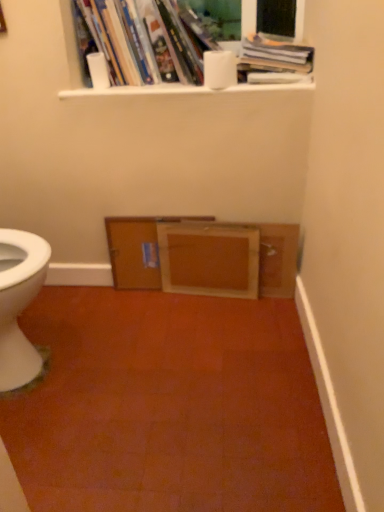
The height and width of the screenshot is (512, 384). What do you see at coordinates (135, 249) in the screenshot? I see `wooden frame at center` at bounding box center [135, 249].

The image size is (384, 512). Describe the element at coordinates (138, 250) in the screenshot. I see `wooden cabinet at center, placed as the first file cabinet when sorted from left to right` at that location.

This screenshot has width=384, height=512. What do you see at coordinates (275, 58) in the screenshot?
I see `hardcover book at upper center, positioned as the first book in right-to-left order` at bounding box center [275, 58].

Where is `wooden frame at center, acting as the 2th file cabinet starting from the left`? This screenshot has height=512, width=384. wooden frame at center, acting as the 2th file cabinet starting from the left is located at coordinates (209, 259).

This screenshot has height=512, width=384. Describe the element at coordinates (209, 259) in the screenshot. I see `wooden frame at center, which is counted as the first file cabinet, starting from the right` at that location.

This screenshot has width=384, height=512. What are the coordinates of `white glossy window sill at upper center` in the screenshot? It's located at (183, 90).

Is white matte toilet paper at upper center, arranged as the second toilet paper when viewed from the left, far from wooden frame at center, which is counted as the first file cabinet, starting from the right?

No, there isn't a large distance between white matte toilet paper at upper center, arranged as the second toilet paper when viewed from the left, and wooden frame at center, which is counted as the first file cabinet, starting from the right.

Is white matte toilet paper at upper center, arranged as the second toilet paper when viewed from the left, oriented towards wooden frame at center, which is counted as the first file cabinet, starting from the right?

No.

Which object is closer to the camera taking this photo, white matte toilet paper at upper center, which is counted as the first toilet paper, starting from the right, or wooden frame at center, which is counted as the first file cabinet, starting from the right?

white matte toilet paper at upper center, which is counted as the first toilet paper, starting from the right.

Is white matte toilet paper at upper center, which is counted as the first toilet paper, starting from the right, spatially inside wooden frame at center, acting as the 2th file cabinet starting from the left, or outside of it?

white matte toilet paper at upper center, which is counted as the first toilet paper, starting from the right, exists outside the volume of wooden frame at center, acting as the 2th file cabinet starting from the left.

Is wooden frame at center, which is counted as the first file cabinet, starting from the right, shorter than white matte toilet paper at upper center, arranged as the second toilet paper when viewed from the left?

No.

In the image, is wooden frame at center, which is counted as the first file cabinet, starting from the right, positioned in front of or behind white matte toilet paper at upper center, which is counted as the first toilet paper, starting from the right?

wooden frame at center, which is counted as the first file cabinet, starting from the right, is positioned farther from the viewer than white matte toilet paper at upper center, which is counted as the first toilet paper, starting from the right.

From the image's perspective, between wooden frame at center, acting as the 2th file cabinet starting from the left, and white matte toilet paper at upper center, which is counted as the first toilet paper, starting from the right, who is located below?

From the image's view, wooden frame at center, acting as the 2th file cabinet starting from the left, is below.

Looking at the image, does wooden frame at center, acting as the 2th file cabinet starting from the left, seem bigger or smaller compared to white matte toilet paper at upper center, arranged as the second toilet paper when viewed from the left?

Clearly, wooden frame at center, acting as the 2th file cabinet starting from the left, is larger in size than white matte toilet paper at upper center, arranged as the second toilet paper when viewed from the left.

Which object is wider, hardcover book at upper center, which appears as the 2th book when viewed from the left, or hardcover books at upper center, the 2th book when ordered from right to left?

hardcover book at upper center, which appears as the 2th book when viewed from the left, is wider.

From the image's perspective, which one is positioned higher, hardcover book at upper center, positioned as the first book in right-to-left order, or hardcover books at upper center, which is counted as the first book, starting from the left?

hardcover books at upper center, which is counted as the first book, starting from the left.

Can you confirm if hardcover book at upper center, which appears as the 2th book when viewed from the left, is positioned to the left of hardcover books at upper center, the 2th book when ordered from right to left?

Incorrect, hardcover book at upper center, which appears as the 2th book when viewed from the left, is not on the left side of hardcover books at upper center, the 2th book when ordered from right to left.

From a real-world perspective, which is physically above, hardcover book at upper center, positioned as the first book in right-to-left order, or hardcover books at upper center, which is counted as the first book, starting from the left?

hardcover books at upper center, which is counted as the first book, starting from the left.

Considering the positions of objects wooden frame at center and hardcover book at upper center, positioned as the first book in right-to-left order, in the image provided, who is more to the left, wooden frame at center or hardcover book at upper center, positioned as the first book in right-to-left order,?

wooden frame at center is more to the left.

From the image's perspective, is wooden frame at center beneath hardcover book at upper center, which appears as the 2th book when viewed from the left?

Answer: Correct, wooden frame at center appears lower than hardcover book at upper center, which appears as the 2th book when viewed from the left, in the image.

From a real-world perspective, relative to hardcover book at upper center, positioned as the first book in right-to-left order, is wooden frame at center vertically above or below?

wooden frame at center is situated lower than hardcover book at upper center, positioned as the first book in right-to-left order, in the real world.

Based on the photo, does wooden frame at center have a smaller size compared to hardcover book at upper center, positioned as the first book in right-to-left order?

Indeed, wooden frame at center has a smaller size compared to hardcover book at upper center, positioned as the first book in right-to-left order.

Is hardcover books at upper center, which is counted as the first book, starting from the left, in front of or behind wooden cabinet at center, the second file cabinet when ordered from right to left, in the image?

In the image, hardcover books at upper center, which is counted as the first book, starting from the left, appears in front of wooden cabinet at center, the second file cabinet when ordered from right to left.

From the image's perspective, between hardcover books at upper center, which is counted as the first book, starting from the left, and wooden cabinet at center, the second file cabinet when ordered from right to left, who is located below?

wooden cabinet at center, the second file cabinet when ordered from right to left.

Is there a large distance between hardcover books at upper center, which is counted as the first book, starting from the left, and wooden cabinet at center, placed as the first file cabinet when sorted from left to right?

No, hardcover books at upper center, which is counted as the first book, starting from the left, is not far from wooden cabinet at center, placed as the first file cabinet when sorted from left to right.

Does hardcover books at upper center, which is counted as the first book, starting from the left, have a lesser width compared to wooden cabinet at center, the second file cabinet when ordered from right to left?

Incorrect, the width of hardcover books at upper center, which is counted as the first book, starting from the left, is not less than that of wooden cabinet at center, the second file cabinet when ordered from right to left.

How far apart are hardcover books at upper center, which is counted as the first book, starting from the left, and wooden frame at center?

24.77 inches.

Is wooden frame at center completely or partially inside hardcover books at upper center, the 2th book when ordered from right to left?

No, wooden frame at center is not inside hardcover books at upper center, the 2th book when ordered from right to left.

From the image's perspective, between hardcover books at upper center, the 2th book when ordered from right to left, and wooden frame at center, which one is located above?

hardcover books at upper center, the 2th book when ordered from right to left, from the image's perspective.

Find the location of a particular element. The width and height of the screenshot is (384, 512). entertainment center behind the hardcover books at upper center, the 2th book when ordered from right to left is located at coordinates (135, 249).

From the image's perspective, is hardcover book at upper center, positioned as the first book in right-to-left order, located above or below wooden cabinet at center, the second file cabinet when ordered from right to left?

hardcover book at upper center, positioned as the first book in right-to-left order, is above wooden cabinet at center, the second file cabinet when ordered from right to left.

Is the surface of hardcover book at upper center, which appears as the 2th book when viewed from the left, in direct contact with wooden cabinet at center, the second file cabinet when ordered from right to left?

hardcover book at upper center, which appears as the 2th book when viewed from the left, is not next to wooden cabinet at center, the second file cabinet when ordered from right to left, and they're not touching.

Is point (262, 80) closer to viewer compared to point (137, 268)?

That is True.

Which of these two, hardcover book at upper center, positioned as the first book in right-to-left order, or wooden cabinet at center, the second file cabinet when ordered from right to left, is wider?

hardcover book at upper center, positioned as the first book in right-to-left order.

The height and width of the screenshot is (512, 384). I want to click on file cabinet that is the 2nd object directly below the white matte toilet paper at upper center, which is counted as the first toilet paper, starting from the right (from a real-world perspective), so click(209, 259).

From the white matte toilet paper at upper center, which is counted as the first toilet paper, starting from the right, count the 1st file cabinet to the left and point to it. Please provide its 2D coordinates.

[(209, 259)]

When comparing their distances from hardcover books at upper center, the 2th book when ordered from right to left, does white matte toilet paper at upper center, the first toilet paper when ordered from left to right, or wooden cabinet at center, the second file cabinet when ordered from right to left, seem closer?

Among the two, white matte toilet paper at upper center, the first toilet paper when ordered from left to right, is located nearer to hardcover books at upper center, the 2th book when ordered from right to left.

Based on their spatial positions, is white glossy window sill at upper center or hardcover books at upper center, which is counted as the first book, starting from the left, closer to hardcover book at upper center, which appears as the 2th book when viewed from the left?

white glossy window sill at upper center.

Based on their spatial positions, is hardcover book at upper center, positioned as the first book in right-to-left order, or wooden frame at center further from hardcover books at upper center, the 2th book when ordered from right to left?

Based on the image, wooden frame at center appears to be further to hardcover books at upper center, the 2th book when ordered from right to left.

Based on their spatial positions, is wooden frame at center, which is counted as the first file cabinet, starting from the right, or wooden cabinet at center, placed as the first file cabinet when sorted from left to right, closer to white glossy window sill at upper center?

A: Among the two, wooden cabinet at center, placed as the first file cabinet when sorted from left to right, is located nearer to white glossy window sill at upper center.

Considering their positions, is hardcover book at upper center, positioned as the first book in right-to-left order, positioned further to white glossy window sill at upper center than hardcover books at upper center, which is counted as the first book, starting from the left?

hardcover books at upper center, which is counted as the first book, starting from the left, is positioned further to the anchor white glossy window sill at upper center.

Which object lies nearer to the anchor point wooden frame at center, acting as the 2th file cabinet starting from the left, hardcover books at upper center, which is counted as the first book, starting from the left, or wooden frame at center?

Based on the image, wooden frame at center appears to be nearer to wooden frame at center, acting as the 2th file cabinet starting from the left.

Considering their positions, is white matte toilet paper at upper center, the second toilet paper when ordered from right to left, positioned closer to white matte toilet paper at upper center, arranged as the second toilet paper when viewed from the left, than wooden frame at center?

Among the two, white matte toilet paper at upper center, the second toilet paper when ordered from right to left, is located nearer to white matte toilet paper at upper center, arranged as the second toilet paper when viewed from the left.

From the image, which object appears to be farther from hardcover books at upper center, which is counted as the first book, starting from the left, wooden cabinet at center, placed as the first file cabinet when sorted from left to right, or wooden frame at center, acting as the 2th file cabinet starting from the left?

The object further to hardcover books at upper center, which is counted as the first book, starting from the left, is wooden frame at center, acting as the 2th file cabinet starting from the left.

At what (x,y) coordinates should I click in order to perform the action: click on window sill between white matte toilet paper at upper center, the second toilet paper when ordered from right to left, and wooden cabinet at center, placed as the first file cabinet when sorted from left to right, in the vertical direction. Please return your answer as a coordinate pair (x, y). The height and width of the screenshot is (512, 384). Looking at the image, I should click on (183, 90).

The height and width of the screenshot is (512, 384). What are the coordinates of `toilet paper between white glossy window sill at upper center and wooden frame at center, which is counted as the first file cabinet, starting from the right, from top to bottom` in the screenshot? It's located at (219, 69).

The image size is (384, 512). Find the location of `window sill between hardcover books at upper center, the 2th book when ordered from right to left, and wooden frame at center from top to bottom`. window sill between hardcover books at upper center, the 2th book when ordered from right to left, and wooden frame at center from top to bottom is located at coordinates (183, 90).

Image resolution: width=384 pixels, height=512 pixels. I want to click on window sill located between white matte toilet paper at upper center, the first toilet paper when ordered from left to right, and hardcover book at upper center, positioned as the first book in right-to-left order, in the left-right direction, so click(x=183, y=90).